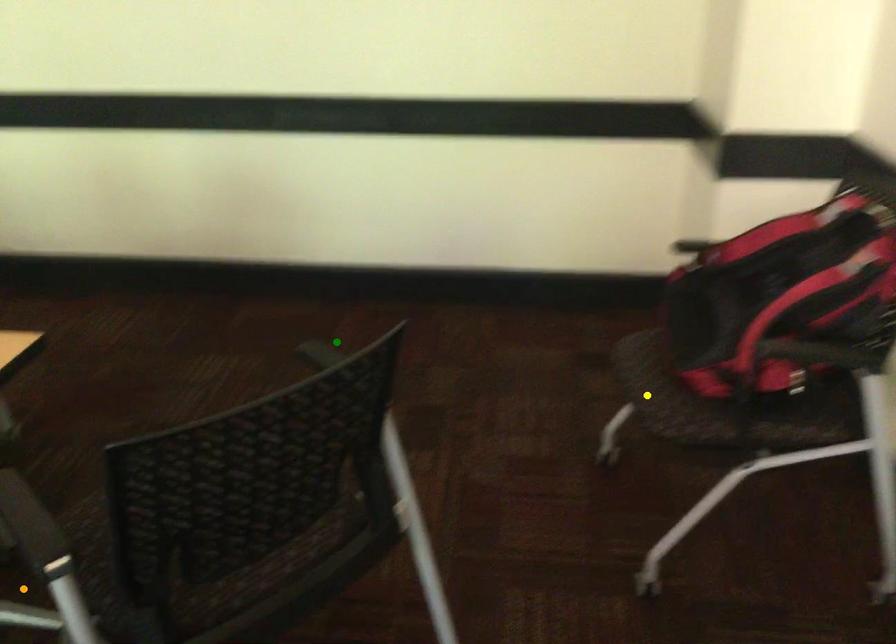
Order these from nearest to farthest:
1. yellow point
2. green point
3. orange point

orange point
yellow point
green point